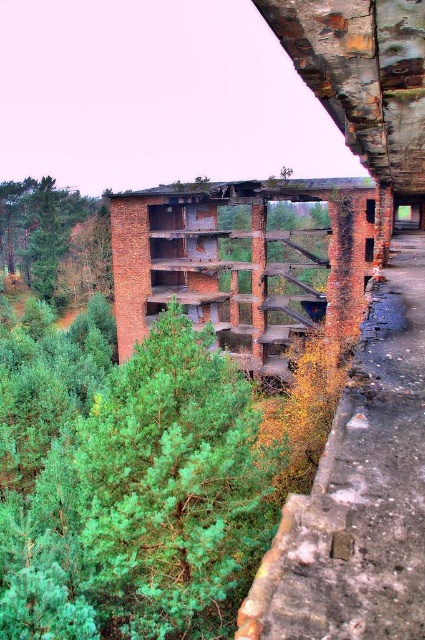
You are a hiker with a 10 meter long rope. You are standing at the entrance of the abandoned structure and see the rusty brick bridge at center. Can you safely cross the bridge using your rope?

The rusty brick bridge at center is 12.67 meters away from the viewer. Since your rope is only 10 meters long, it is not long enough to safely cross the bridge.

You are a hiker exploring the forest and want to cross the river below. You see the rusty brick bridge at center and the rusty metal overpass at upper center. Which structure should you approach first if you want to reach the river as quickly as possible?

You should approach the rusty brick bridge at center first because it is closer to you than the rusty metal overpass at upper center, which is further away.

You are an explorer trying to cross from one side of the forest to the other. You notice a rusty metal overpass at upper center and a green leafy tree at upper left. Which structure is narrower in width, allowing for a safer crossing?

The rusty metal overpass at upper center is narrower in width than the green leafy tree at upper left, making it the safer option for crossing.